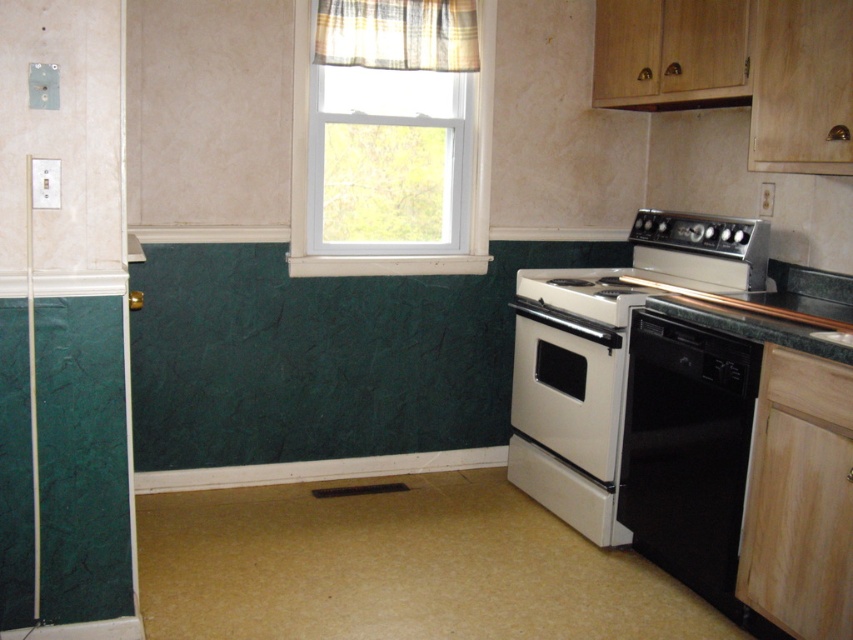
Question: Which object appears closest to the camera in this image?

Choices:
 (A) white plastic window at upper center
 (B) black granite sink at lower right

Answer: (B)

Question: Which point is closer to the camera?

Choices:
 (A) white plastic window at upper center
 (B) black granite sink at lower right
 (C) white glossy stove at right
 (D) black matte dishwasher at lower right

Answer: (B)

Question: Can you confirm if white glossy stove at right is wider than white plastic window at upper center?

Choices:
 (A) no
 (B) yes

Answer: (B)

Question: Can you confirm if white glossy oven at lower right is bigger than white plastic window at upper center?

Choices:
 (A) no
 (B) yes

Answer: (A)

Question: Can you confirm if white glossy stove at right is bigger than black matte dishwasher at lower right?

Choices:
 (A) yes
 (B) no

Answer: (A)

Question: Which object is positioned closest to the white glossy stove at right?

Choices:
 (A) black matte dishwasher at lower right
 (B) matte white exhaust hood at upper center
 (C) white plastic window at upper center
 (D) green marble countertop at right

Answer: (A)